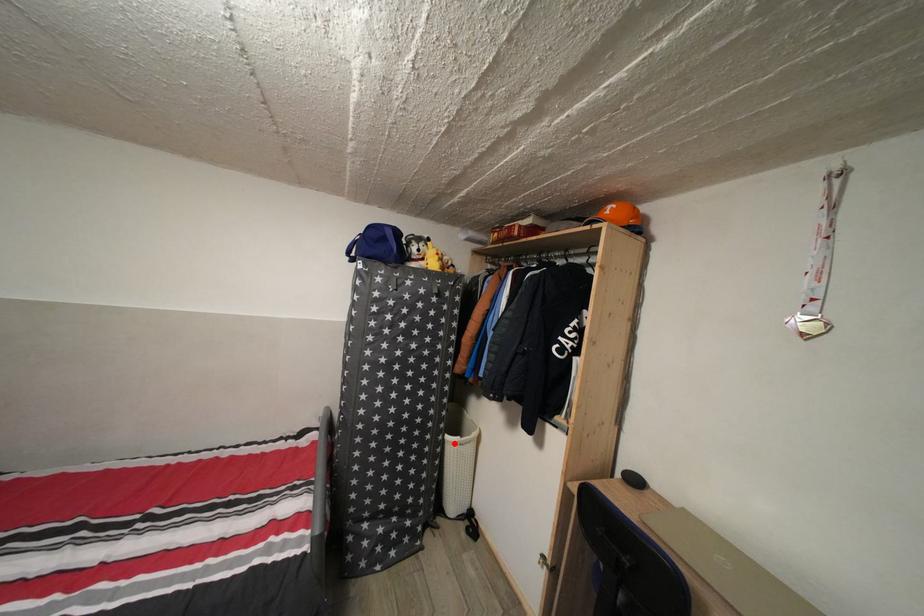
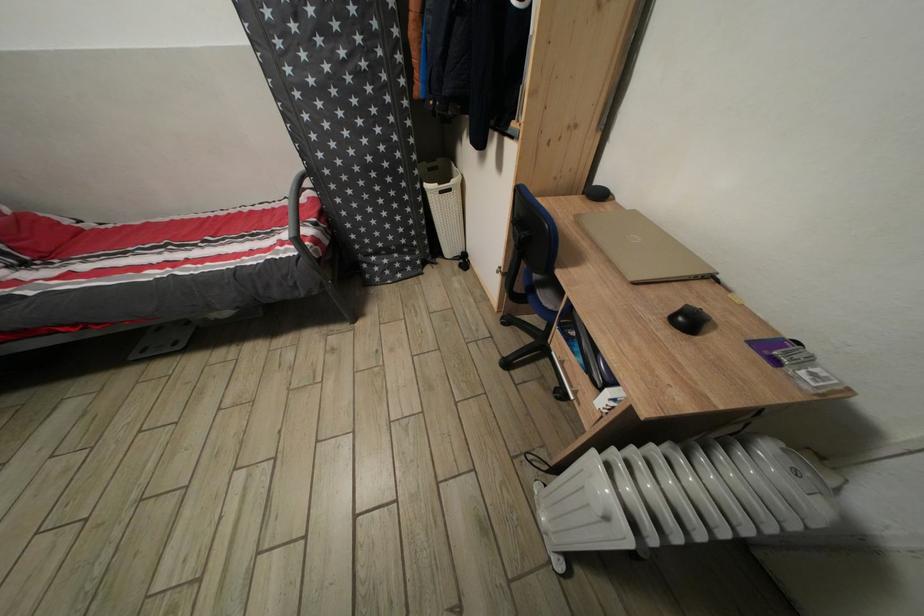
In the second image, find the point that corresponds to the highlighted location in the first image.

(432, 192)